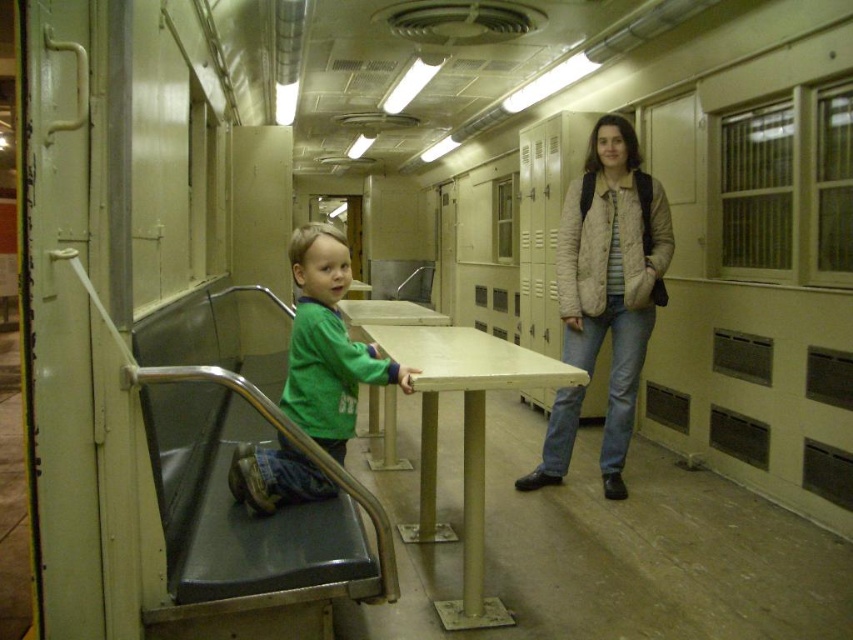
Question: In this image, where is light beige textured jacket at center located relative to matte yellow table at center?

Choices:
 (A) below
 (B) above

Answer: (B)

Question: Estimate the real-world distances between objects in this image. Which object is closer to the matte yellow table at center?

Choices:
 (A) light beige textured jacket at center
 (B) green matte shirt at center

Answer: (B)

Question: Is matte yellow table at center positioned behind green matte shirt at center?

Choices:
 (A) no
 (B) yes

Answer: (B)

Question: Can you confirm if light beige textured jacket at center is smaller than green matte shirt at center?

Choices:
 (A) no
 (B) yes

Answer: (A)

Question: Which of the following is the closest to the observer?

Choices:
 (A) (341, 260)
 (B) (564, 305)

Answer: (A)

Question: Which of the following is the closest to the observer?

Choices:
 (A) light beige textured jacket at center
 (B) green matte shirt at center
 (C) matte yellow table at center

Answer: (B)